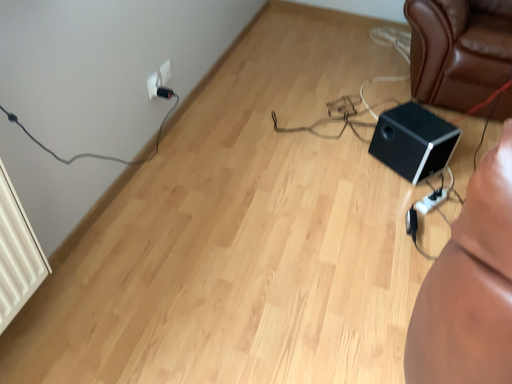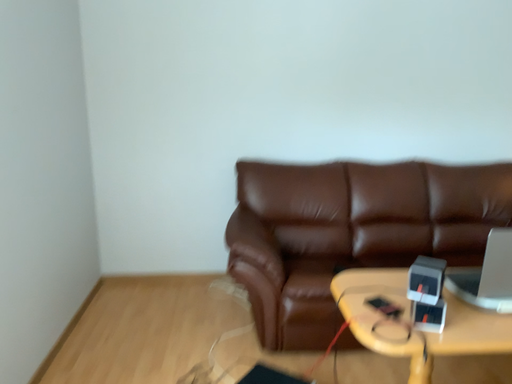
Question: Which way did the camera rotate in the video?

Choices:
 (A) rotated downward
 (B) rotated upward

Answer: (B)